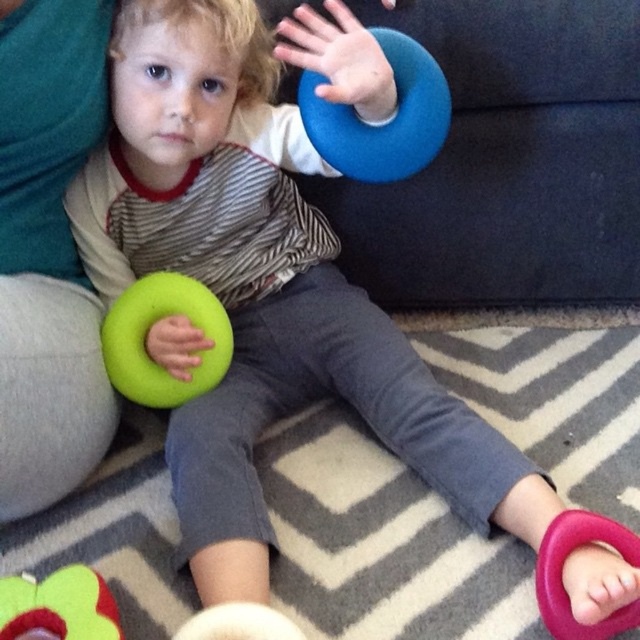
Between soft plush flower at lower left and pink rubber ring at lower right, which one has more height?

With more height is pink rubber ring at lower right.

Can you confirm if soft plush flower at lower left is positioned to the right of pink rubber ring at lower right?

Incorrect, soft plush flower at lower left is not on the right side of pink rubber ring at lower right.

The height and width of the screenshot is (640, 640). I want to click on soft plush flower at lower left, so click(x=58, y=605).

Which is behind, point (388, 152) or point (214, 317)?

The point (214, 317) is more distant.

Image resolution: width=640 pixels, height=640 pixels. What do you see at coordinates (385, 122) in the screenshot?
I see `blue rubber frisbee at upper center` at bounding box center [385, 122].

Where is `blue rubber frisbee at upper center`? blue rubber frisbee at upper center is located at coordinates (385, 122).

Which of these two, green foam ring at lower left or pink rubber ring at lower right, stands taller?

green foam ring at lower left is taller.

Based on the photo, who is more distant from viewer, (208, 381) or (550, 612)?

The point (208, 381) is behind.

Which is behind, point (120, 385) or point (584, 513)?

Point (120, 385)

The width and height of the screenshot is (640, 640). Identify the location of green foam ring at lower left. (157, 330).